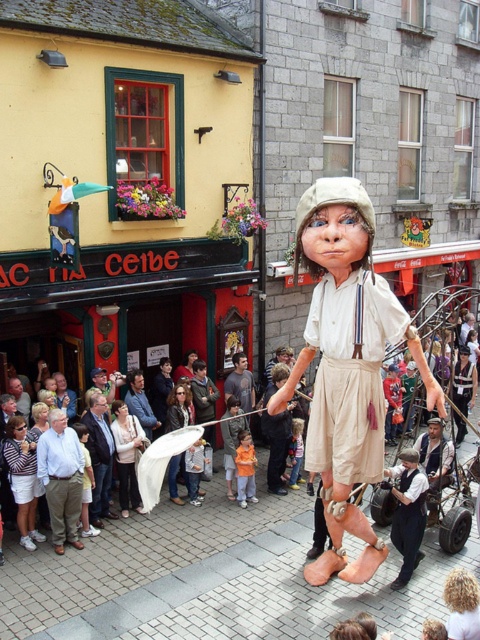
Question: Is khaki pants at lower left bigger than white cotton shirt at center?

Choices:
 (A) yes
 (B) no

Answer: (B)

Question: Which point is closer to the camera?

Choices:
 (A) (415, 566)
 (B) (56, 490)
 (C) (352, 566)
 (D) (252, 403)

Answer: (C)

Question: Considering the relative positions of matte beige fabric doll at center and dark blue t-shirt at center in the image provided, where is matte beige fabric doll at center located with respect to dark blue t-shirt at center?

Choices:
 (A) below
 (B) above

Answer: (A)

Question: Among these objects, which one is nearest to the camera?

Choices:
 (A) dark blue t-shirt at center
 (B) white cotton shirt at center
 (C) khaki pants at lower left

Answer: (B)

Question: Is khaki pants at lower left bigger than dark blue t-shirt at center?

Choices:
 (A) yes
 (B) no

Answer: (A)

Question: Which object is the farthest from the dark blue t-shirt at center?

Choices:
 (A) white cotton shirt at center
 (B) matte beige fabric doll at center
 (C) khaki pants at lower left

Answer: (B)